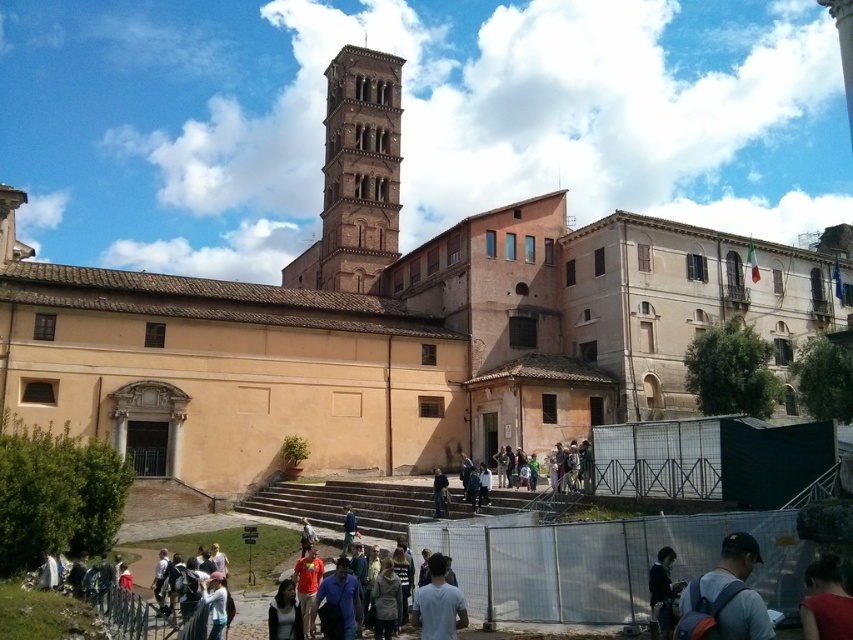
Question: Can you confirm if beige stone church at center is bigger than brown brick tower at center?

Choices:
 (A) no
 (B) yes

Answer: (B)

Question: Is red fabric dress at lower right smaller than dark blue jeans at center?

Choices:
 (A) no
 (B) yes

Answer: (B)

Question: Which object is closer to the camera taking this photo?

Choices:
 (A) dark blue fabric jacket at lower right
 (B) matte blue backpack at lower right

Answer: (B)

Question: Can you confirm if red fabric dress at lower right is wider than dark blue fabric jacket at lower right?

Choices:
 (A) yes
 (B) no

Answer: (A)

Question: Among these points, which one is nearest to the camera?

Choices:
 (A) (80, 332)
 (B) (808, 636)
 (C) (436, 472)

Answer: (B)

Question: Which object is the closest to the brown brick tower at center?

Choices:
 (A) dark blue fabric jacket at lower right
 (B) red fabric dress at lower right
 (C) dark blue jeans at center
 (D) matte blue backpack at lower right

Answer: (C)